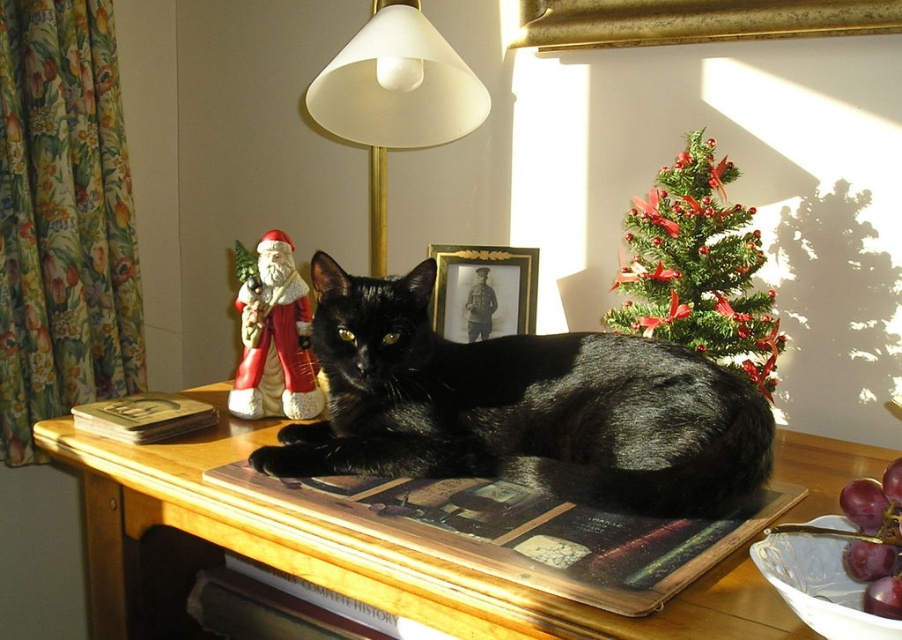
Which is above, shiny black cat at center or wooden table at center?

Positioned higher is shiny black cat at center.

Is shiny black cat at center to the left of wooden table at center from the viewer's perspective?

No, shiny black cat at center is not to the left of wooden table at center.

Find the location of a particular element. The image size is (902, 640). shiny black cat at center is located at coordinates (521, 406).

Which is above, green textured christmas tree at upper right or white matte lampshade at upper center?

Positioned higher is white matte lampshade at upper center.

Is point (728, 312) less distant than point (382, 61)?

Yes, it is.

Identify the location of green textured christmas tree at upper right. Image resolution: width=902 pixels, height=640 pixels. (697, 268).

Who is positioned more to the right, green textured christmas tree at upper right or glossy purple grapes at lower right?

green textured christmas tree at upper right is more to the right.

Is green textured christmas tree at upper right smaller than glossy purple grapes at lower right?

Incorrect, green textured christmas tree at upper right is not smaller in size than glossy purple grapes at lower right.

Identify the location of green textured christmas tree at upper right. The width and height of the screenshot is (902, 640). (697, 268).

Find the location of a particular element. This screenshot has height=640, width=902. green textured christmas tree at upper right is located at coordinates (697, 268).